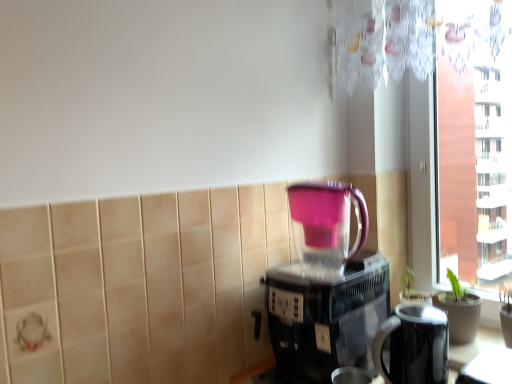
You are a GUI agent. You are given a task and a screenshot of the screen. Output one action in this format:
    pyautogui.click(x=<x>, y=<y>)
    Task: Click on the blank area beneath pink plastic blender at center (from a real-world perspective)
    
    Given the screenshot: What is the action you would take?
    pyautogui.click(x=331, y=268)